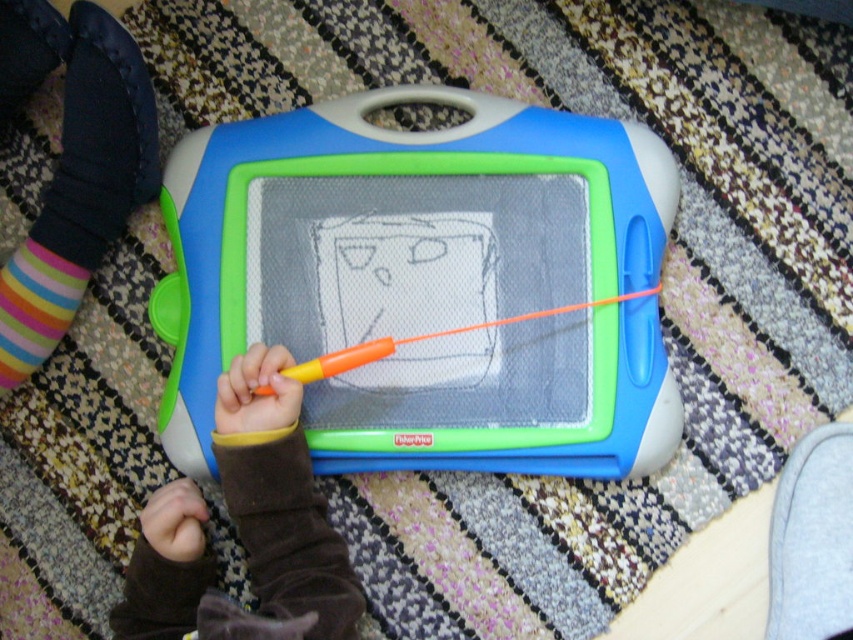
Question: Which point is farther to the camera?

Choices:
 (A) (593, 385)
 (B) (151, 170)
 (C) (213, 426)

Answer: (A)

Question: Considering the relative positions of matte plastic drawing board at center and orange plastic pen at center in the image provided, where is matte plastic drawing board at center located with respect to orange plastic pen at center?

Choices:
 (A) left
 (B) right

Answer: (A)

Question: Among these points, which one is farthest from the camera?

Choices:
 (A) (32, 323)
 (B) (138, 609)
 (C) (381, 340)
 (D) (85, 76)

Answer: (A)

Question: Which point is farther to the camera?

Choices:
 (A) brown velvet hand at center
 (B) multicolored striped sock at lower left
 (C) orange plastic pen at center
 (D) multicolored striped sock at left

Answer: (B)

Question: Is the position of matte plastic drawing board at center more distant than that of orange plastic pen at center?

Choices:
 (A) no
 (B) yes

Answer: (B)

Question: Can you confirm if brown velvet hand at center is positioned to the left of orange plastic pen at center?

Choices:
 (A) yes
 (B) no

Answer: (A)